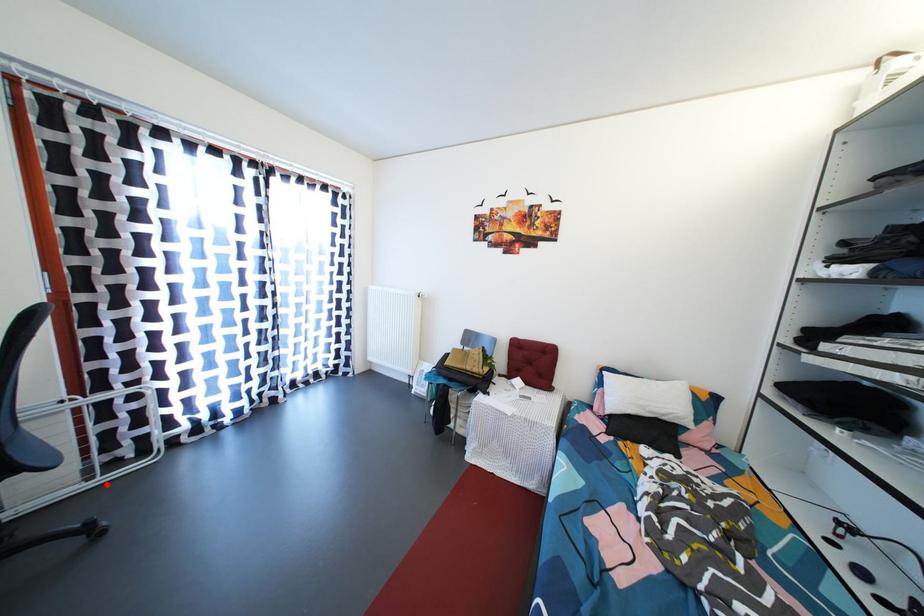
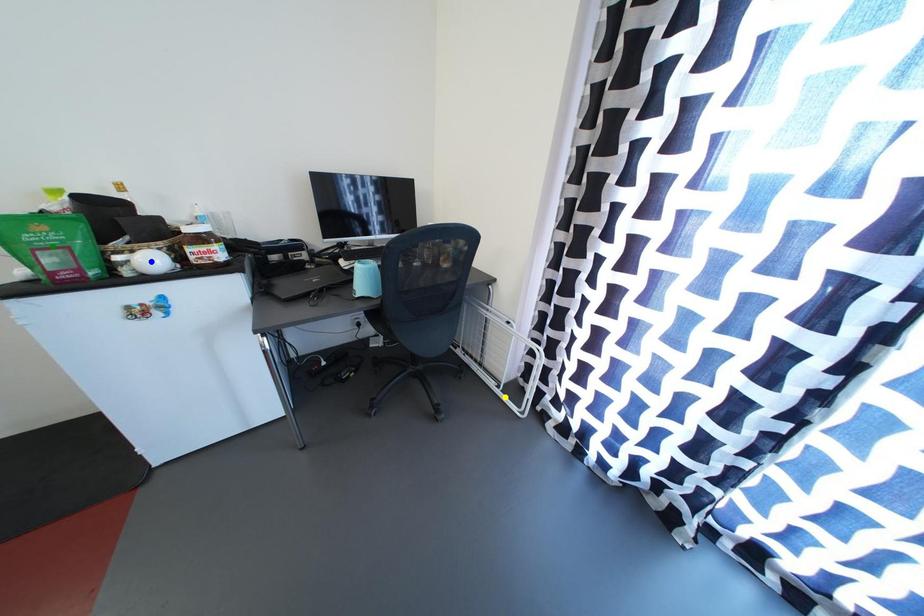
Question: I am providing you with two images of the same scene from different viewpoints. A red point is marked on the first image. You are given multiple points on the second image. Which point in image 2 is actually the same real-world point as the red point in image 1?

Choices:
 (A) blue point
 (B) green point
 (C) yellow point

Answer: (C)